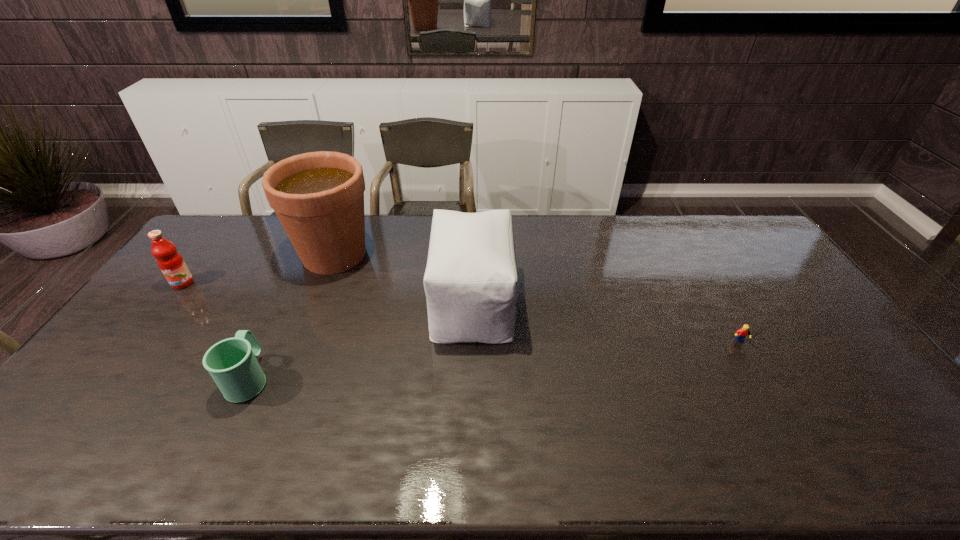
Image resolution: width=960 pixels, height=540 pixels. Find the location of `flowerpot`. flowerpot is located at coordinates (318, 197).

This screenshot has height=540, width=960. What are the coordinates of `cushion` in the screenshot? It's located at (471, 282).

The height and width of the screenshot is (540, 960). In order to click on the fourth shortest object in this screenshot , I will do `click(471, 282)`.

Where is `the leftmost object`? This screenshot has height=540, width=960. the leftmost object is located at coordinates (171, 263).

This screenshot has height=540, width=960. Identify the location of the third shortest object. (171, 263).

What are the coordinates of `the nearest object` in the screenshot? It's located at (232, 363).

I want to click on mug, so click(x=232, y=363).

Where is `the rightmost object`? the rightmost object is located at coordinates (743, 332).

The image size is (960, 540). What are the coordinates of `the shortest object` in the screenshot? It's located at (743, 332).

Find the location of a particular element. vacant space located 0.370m on the right of the tallest object is located at coordinates (480, 254).